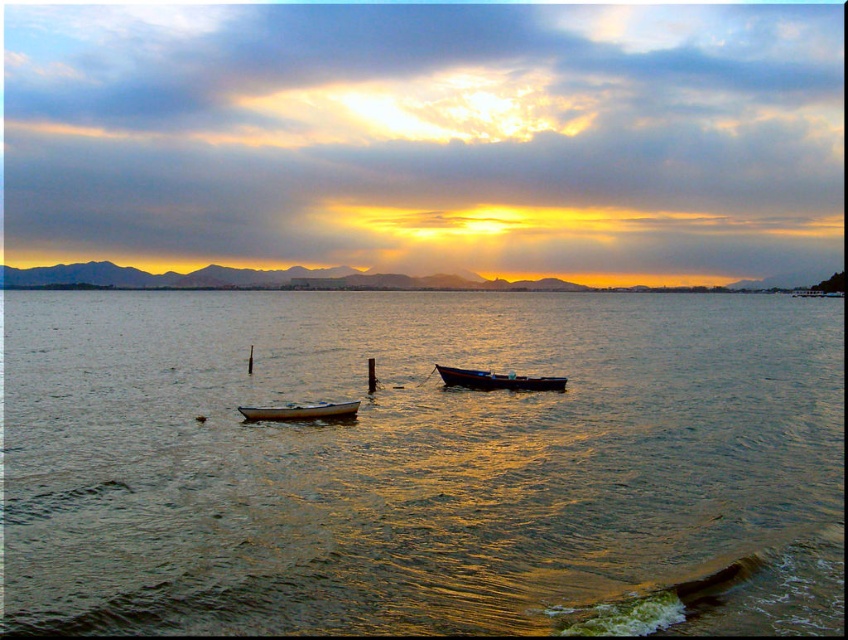
Question: Which object is farther from the camera taking this photo?

Choices:
 (A) wooden boat at center
 (B) greenish water at center

Answer: (A)

Question: Is greenish water at center below white glossy boat at center?

Choices:
 (A) yes
 (B) no

Answer: (B)

Question: Which of these objects is positioned farthest from the wooden boat at center?

Choices:
 (A) greenish water at center
 (B) white glossy boat at center

Answer: (A)

Question: Which object is farther from the camera taking this photo?

Choices:
 (A) white glossy boat at center
 (B) greenish water at center

Answer: (A)

Question: Does greenish water at center appear under white glossy boat at center?

Choices:
 (A) yes
 (B) no

Answer: (B)

Question: Can you confirm if greenish water at center is smaller than white glossy boat at center?

Choices:
 (A) no
 (B) yes

Answer: (A)